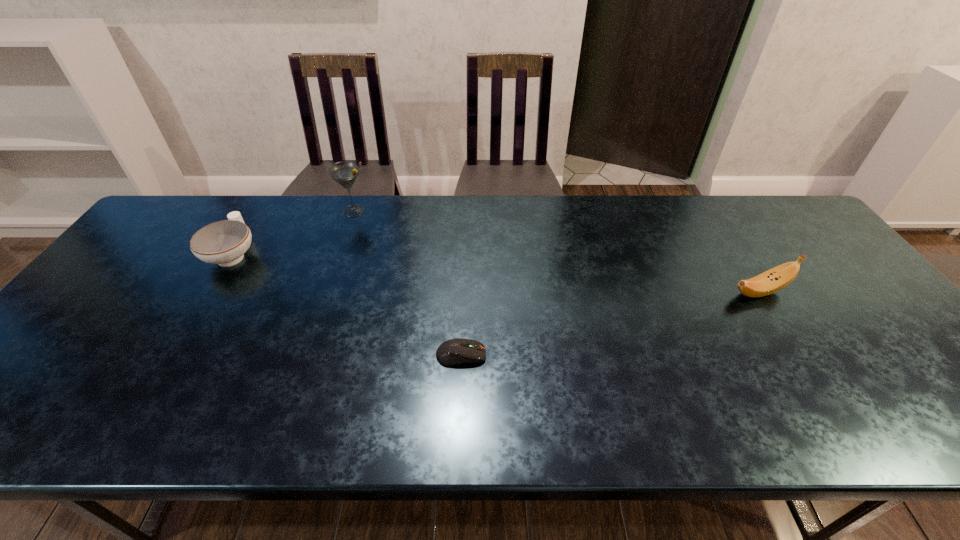
Identify the location of vacant area situated 0.070m on the side with the handle of the leftmost object. This screenshot has width=960, height=540. (254, 219).

Identify the location of vacant area situated 0.120m on the side with the handle of the leftmost object. (260, 210).

The image size is (960, 540). Identify the location of free spot located on the button of the computer equipment. (512, 355).

Where is `martini positioned at the far edge`? This screenshot has width=960, height=540. martini positioned at the far edge is located at coordinates (345, 173).

Where is `chinaware located at the far edge`? This screenshot has height=540, width=960. chinaware located at the far edge is located at coordinates (224, 242).

At what (x,y) coordinates should I click in order to perform the action: click on vacant space at the far edge. Please return your answer as a coordinate pair (x, y). The height and width of the screenshot is (540, 960). Looking at the image, I should click on (649, 218).

In order to click on vacant region at the left edge of the desktop in this screenshot , I will do `click(157, 285)`.

Where is `free space at the right edge of the desktop`? free space at the right edge of the desktop is located at coordinates (889, 350).

Locate an element on the screen. This screenshot has width=960, height=540. free space at the far left corner is located at coordinates (184, 231).

In order to click on vacant space in between the farthest object and the nearest object in this screenshot , I will do `click(407, 283)`.